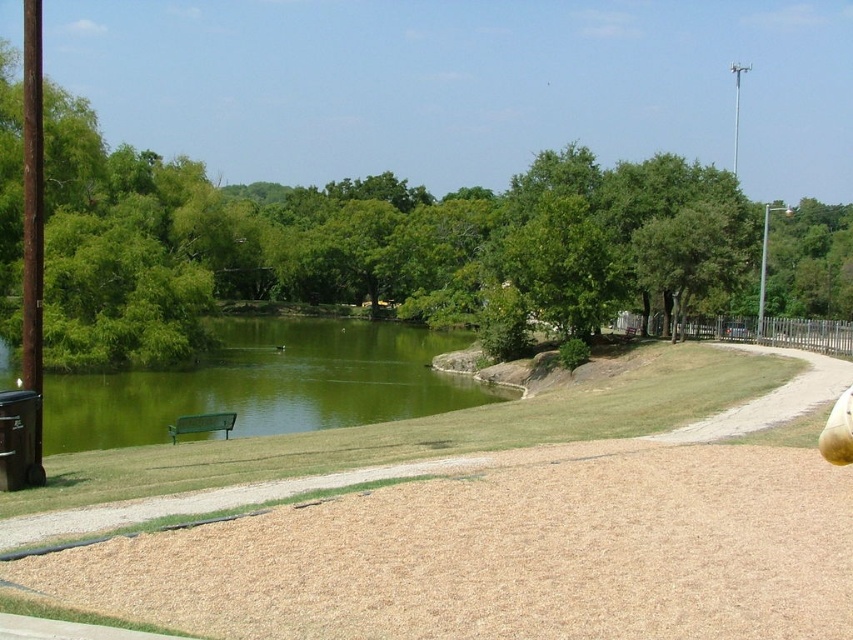
Question: Is brown wood chips at lower center to the left of green liquid water at lower left from the viewer's perspective?

Choices:
 (A) yes
 (B) no

Answer: (B)

Question: Which point is farther from the camera taking this photo?

Choices:
 (A) click(x=440, y=412)
 (B) click(x=213, y=417)

Answer: (A)

Question: Which object is positioned closest to the brown wood chips at lower center?

Choices:
 (A) green matte bench at lower left
 (B) green liquid water at lower left

Answer: (A)

Question: Is green liquid water at lower left bigger than green matte bench at lower left?

Choices:
 (A) yes
 (B) no

Answer: (A)

Question: Based on their relative distances, which object is farther from the green matte bench at lower left?

Choices:
 (A) green liquid water at lower left
 (B) brown wood chips at lower center

Answer: (A)

Question: Does green liquid water at lower left have a greater width compared to green matte bench at lower left?

Choices:
 (A) no
 (B) yes

Answer: (B)